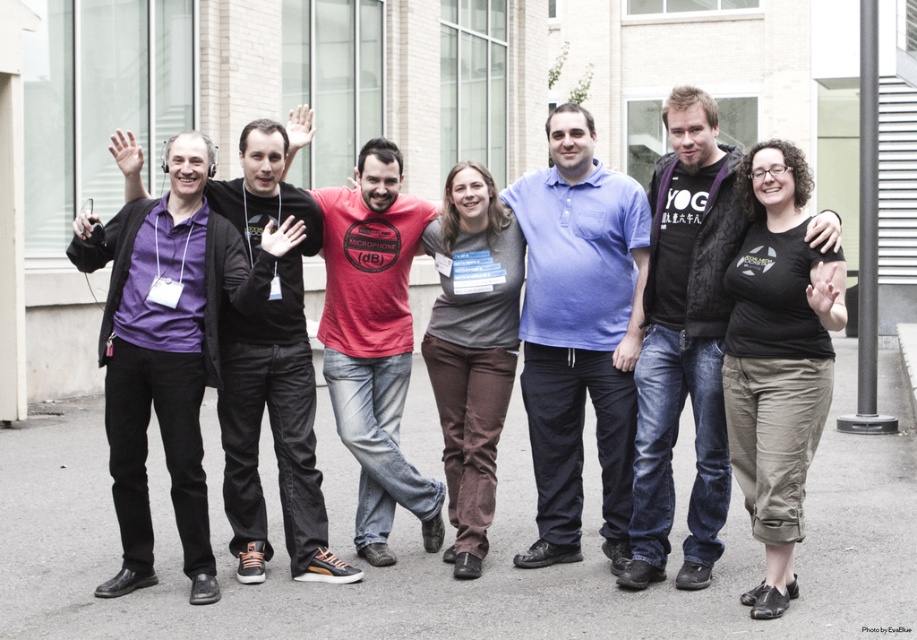
Question: Can you confirm if black cotton shirt at center is smaller than matte red t-shirt at center?

Choices:
 (A) no
 (B) yes

Answer: (B)

Question: Is black matte jacket at center thinner than matte red t-shirt at center?

Choices:
 (A) no
 (B) yes

Answer: (B)

Question: Is the position of black matte jacket at center less distant than that of purple matte shirt at left?

Choices:
 (A) yes
 (B) no

Answer: (A)

Question: Which object is positioned closest to the gray asphalt at center?

Choices:
 (A) blue cotton polo shirt at center
 (B) matte red t-shirt at center

Answer: (B)

Question: Based on their relative distances, which object is farther from the gray asphalt at center?

Choices:
 (A) black cotton shirt at center
 (B) purple matte shirt at left

Answer: (A)

Question: Among these objects, which one is nearest to the camera?

Choices:
 (A) gray cotton shirt at center
 (B) blue cotton polo shirt at center
 (C) purple matte shirt at left

Answer: (C)